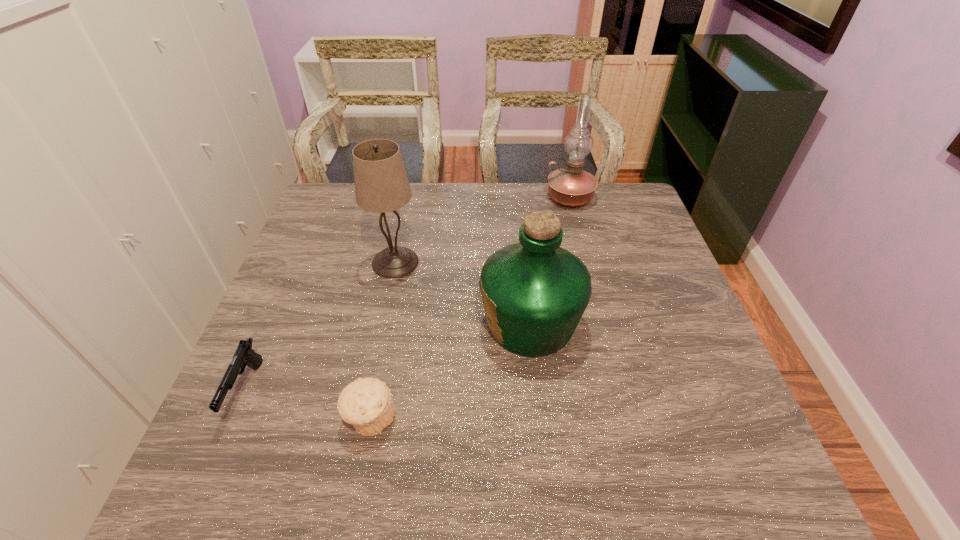
Find the location of a particular element. This screenshot has width=960, height=540. free location located on the left of the muffin is located at coordinates (300, 418).

At what (x,y) coordinates should I click in order to perform the action: click on vacant space situated 0.050m at the aiming end of the gun. Please return your answer as a coordinate pair (x, y). Image resolution: width=960 pixels, height=540 pixels. Looking at the image, I should click on (219, 454).

Identify the location of object that is positioned at the far edge. (571, 186).

Locate an element on the screen. The height and width of the screenshot is (540, 960). object that is at the left edge is located at coordinates (244, 355).

At what (x,y) coordinates should I click in order to perform the action: click on object at the right edge. Please return your answer as a coordinate pair (x, y). Image resolution: width=960 pixels, height=540 pixels. Looking at the image, I should click on (571, 186).

Image resolution: width=960 pixels, height=540 pixels. In order to click on object that is at the far right corner in this screenshot , I will do `click(571, 186)`.

Image resolution: width=960 pixels, height=540 pixels. I want to click on vacant area at the far edge, so pos(403,208).

Where is `vacant space at the near edge of the desktop`? This screenshot has height=540, width=960. vacant space at the near edge of the desktop is located at coordinates click(663, 481).

This screenshot has height=540, width=960. I want to click on vacant point at the left edge, so click(324, 265).

Locate an element on the screen. The width and height of the screenshot is (960, 540). vacant region at the right edge is located at coordinates (652, 344).